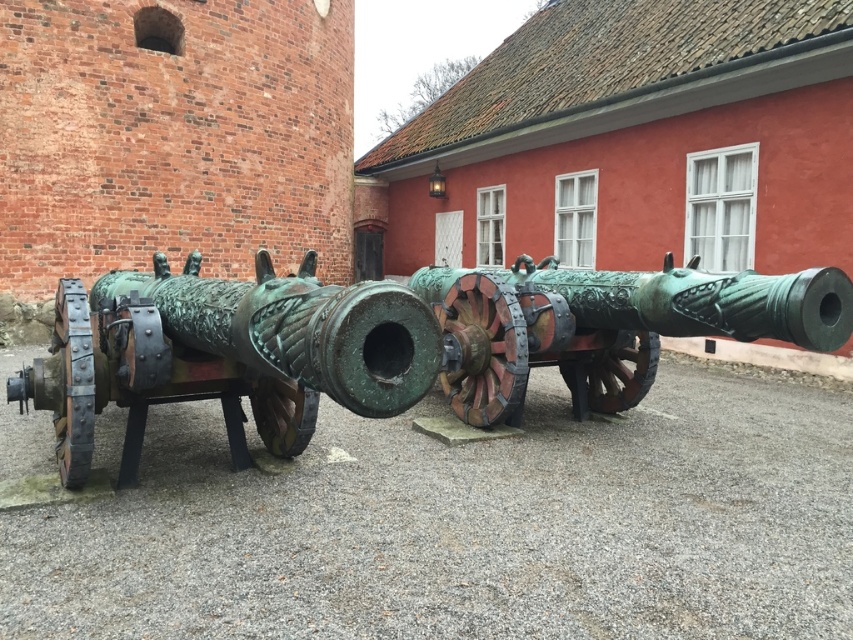
You are a historian examining the cannons in front of the red brick building. Which cannon, the green patina bronze cannon at left or the bronze textured cannon at center, is located more to the east if the building faces north?

The green patina bronze cannon at left is positioned on the left side of bronze textured cannon at center. Since the building faces north, the left side would correspond to the east direction. Therefore, the green patina bronze cannon at left is located more to the east.

You are an artillery expert examining two cannons in a historical exhibit. You need to determine which cannon has a larger size between the green patina bronze cannon at left and the bronze textured cannon at center. Based on the scene, which one is bigger?

The green patina bronze cannon at left is bigger than the bronze textured cannon at center.

You are a historian examining the cannons in the image. The cannons are positioned side by side on a paved ground. Which cannon is located at the point with coordinates (225, 355)?

The point at (225, 355) marks the green patina bronze cannon at left.